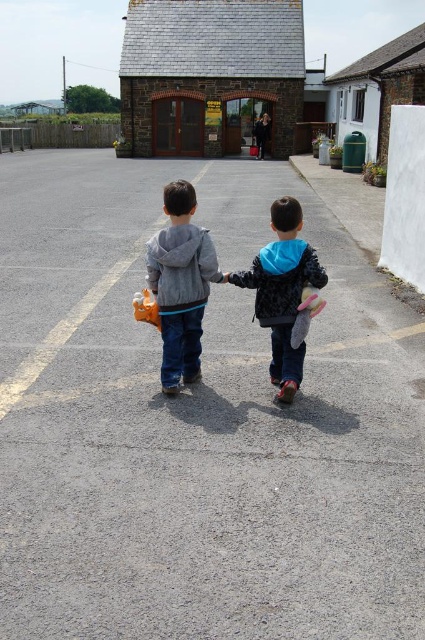
You are a parent trying to locate your child who dropped a toy. You see the pink fabric toy at center and the orange rubber duck at center in the image. Which toy is closer to the right side of the image?

The pink fabric toy at center is to the right of the orange rubber duck at center, so it is closer to the right side of the image.